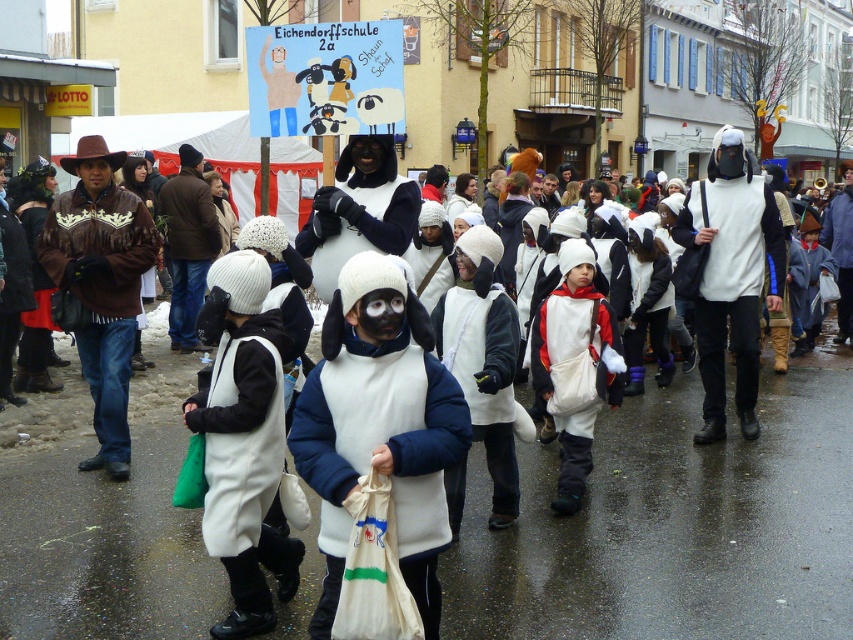
You are standing at the origin point of the image coordinate system, which is the bottom left corner. You want to locate the white fleece costume at center. What are its coordinates?

The white fleece costume at center is located at coordinates 0.670 in the x axis and 0.445 in the y axis.

You are a photographer trying to capture a photo of the white matte snowsuit at center and the white matte penguin at center. Which one should you focus on first if you want to ensure both are in the frame without moving the camera?

The white matte snowsuit at center is taller than the white matte penguin at center, so you should focus on the white matte penguin at center first to ensure it stays in the frame while adjusting for the taller snowsuit.

Based on the photo, you are a photographer trying to capture both the white fleece costume at center and the white fleece vest at center in a single frame. Which one should you focus on to ensure both are in the frame without cropping?

The white fleece vest at center is smaller than the white fleece costume at center, so focusing on the larger white fleece costume at center will ensure both are visible in the frame without cropping.